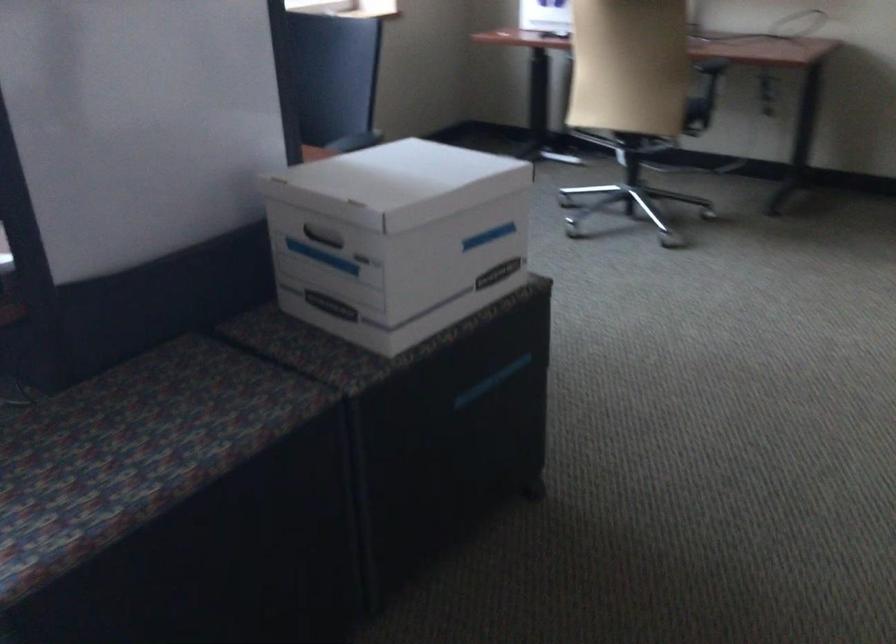
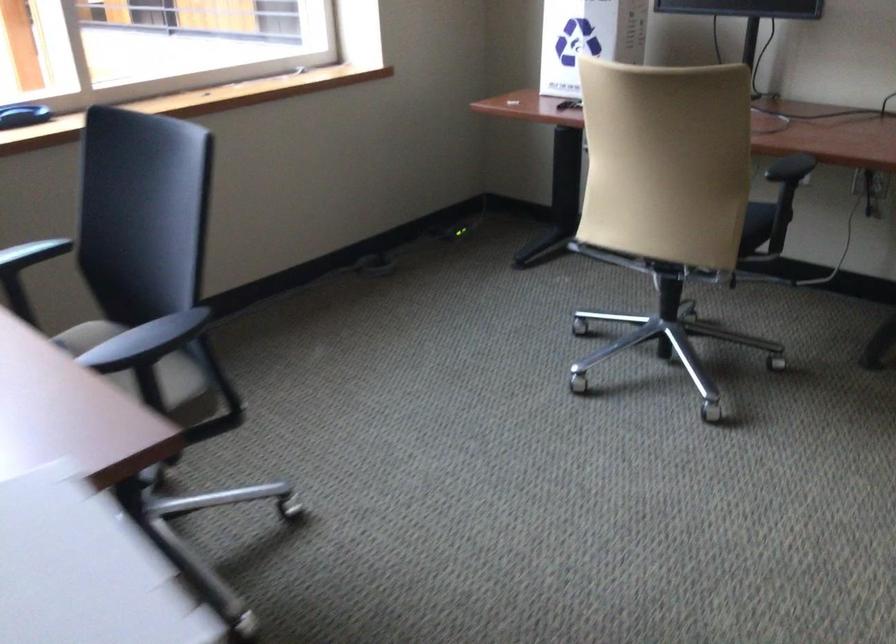
In a continuous first-person perspective shot, in which direction is the camera moving?

The cameraman moved toward right, forward.